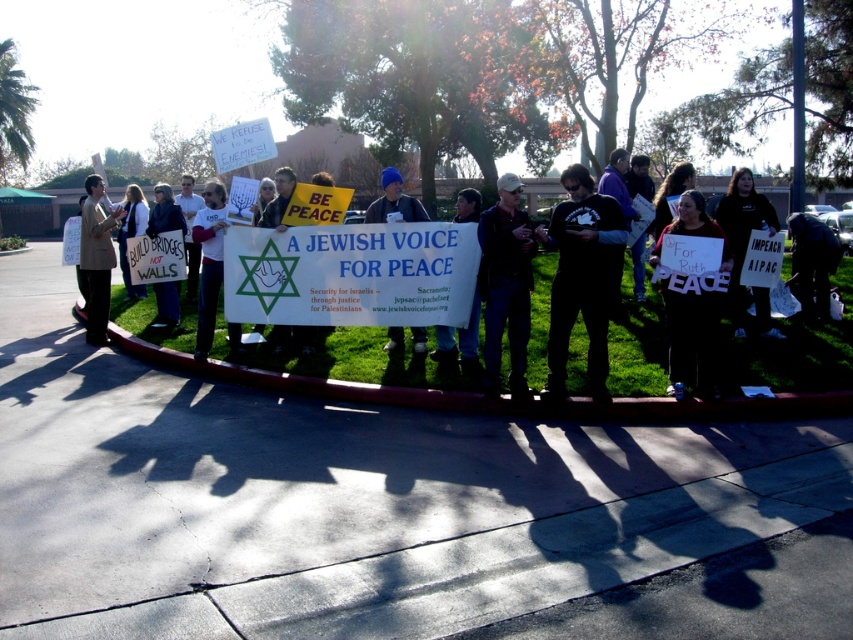
You are a photographer trying to capture a photo of the protest scene. You want to ensure both the dark blue jeans at lower right and the matte black jacket at center are clearly visible in the frame. Based on their positions, which object should you prioritize framing closer to the right side of the photo?

The dark blue jeans at lower right should be framed closer to the right side of the photo since it is positioned on the right side of the matte black jacket at center.

You are a photographer trying to capture the banner in the protest scene. The banner is held by people in the foreground. You notice a point at coordinates point (811,262). Where is this point located in relation to the banner?

The point (811,262) is located on dark blue jeans at lower right, which are part of the people holding the banner, so it is near the lower right edge of the banner.